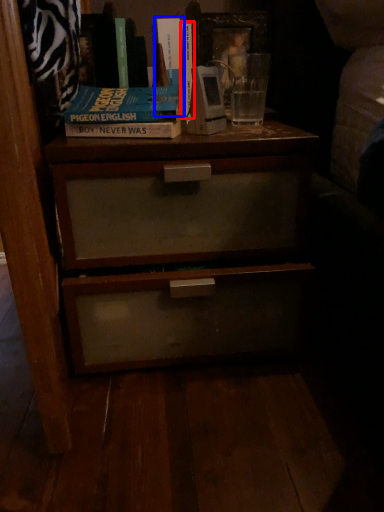
Question: Which object is further to the camera taking this photo, book (highlighted by a red box) or book (highlighted by a blue box)?

Choices:
 (A) book
 (B) book

Answer: (A)